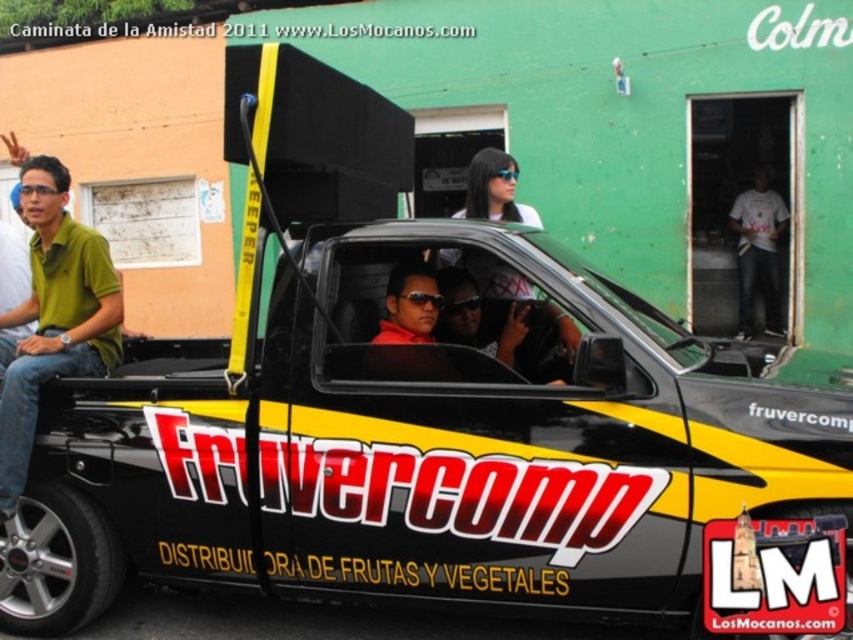
Between green matte shirt at left and white t-shirt at center, which one has less height?

green matte shirt at left is shorter.

This screenshot has width=853, height=640. What are the coordinates of `green matte shirt at left` in the screenshot? It's located at [54, 316].